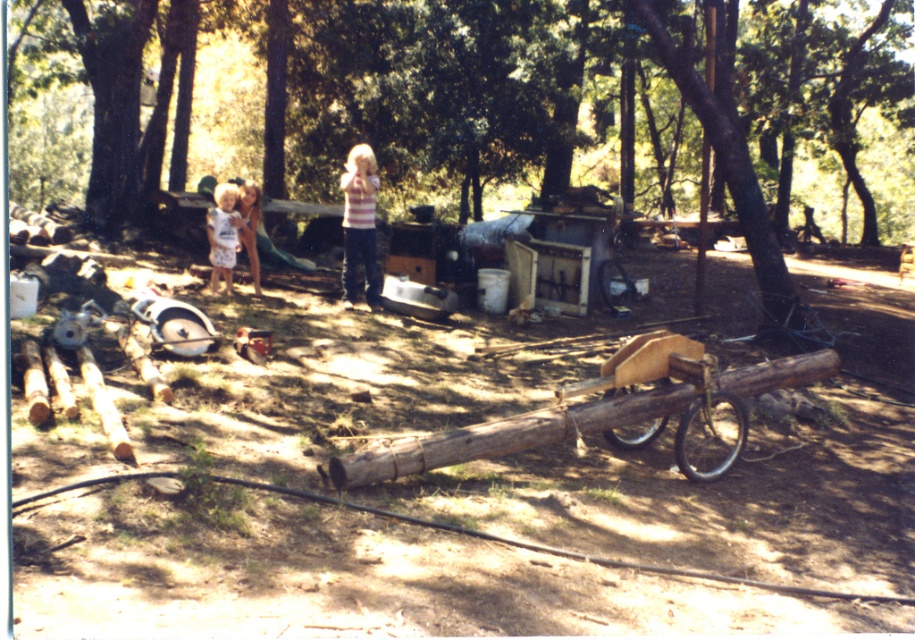
Question: Does wooden cart at center appear over white cotton dress at left?

Choices:
 (A) no
 (B) yes

Answer: (A)

Question: Which point appears closest to the camera in this image?

Choices:
 (A) (256, 192)
 (B) (366, 467)

Answer: (B)

Question: Can you confirm if wooden cart at center is positioned to the left of striped shirt at center?

Choices:
 (A) no
 (B) yes

Answer: (A)

Question: Which of the following is the farthest from the observer?

Choices:
 (A) [127, 28]
 (B) [255, 202]

Answer: (A)

Question: Can you confirm if wooden cart at center is wider than white cotton dress at left?

Choices:
 (A) yes
 (B) no

Answer: (A)

Question: Among these points, which one is nearest to the camera?

Choices:
 (A) (660, 45)
 (B) (253, 272)
 (C) (219, 205)
 (D) (361, 188)

Answer: (D)